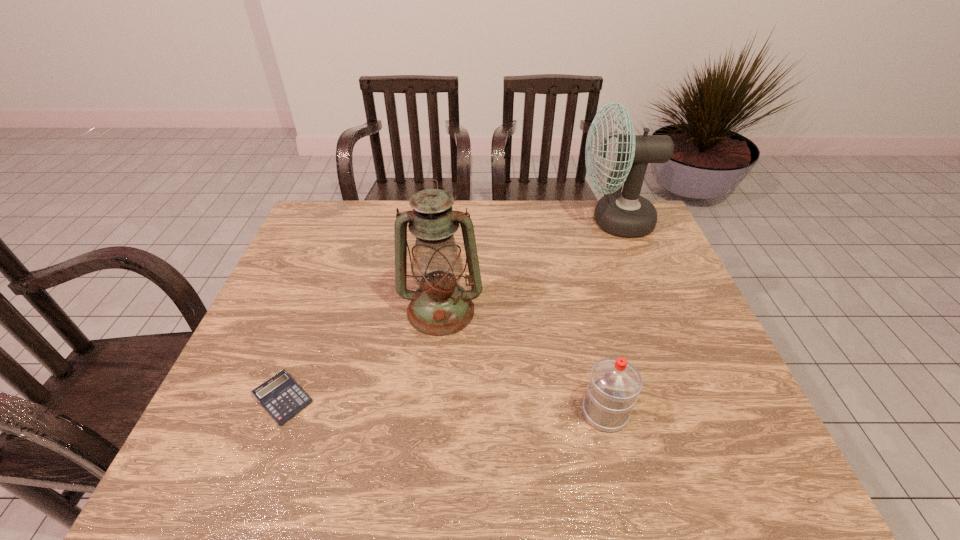
In order to click on fan in this screenshot , I will do `click(627, 214)`.

Where is `the farthest object`? the farthest object is located at coordinates (627, 214).

Find the location of a particular element. The image size is (960, 540). the second farthest object is located at coordinates [440, 306].

Identify the location of the second object from left to right. The height and width of the screenshot is (540, 960). (440, 306).

This screenshot has width=960, height=540. I want to click on the third tallest object, so click(x=614, y=385).

You are a GUI agent. You are given a task and a screenshot of the screen. Output one action in this format:
    pyautogui.click(x=<x>, y=<y>)
    Task: Click on the water bottle
    Image resolution: width=960 pixels, height=540 pixels.
    Given the screenshot: What is the action you would take?
    pyautogui.click(x=614, y=385)

Locate an element on the screen. The height and width of the screenshot is (540, 960). the leftmost object is located at coordinates (281, 396).

You are a GUI agent. You are given a task and a screenshot of the screen. Output one action in this format:
    pyautogui.click(x=<x>, y=<y>)
    Task: Click on the shortest object
    
    Given the screenshot: What is the action you would take?
    pyautogui.click(x=281, y=396)

Find the location of a particular element. Image resolution: width=960 pixels, height=540 pixels. free space located in front of the fan where the airflow is directed is located at coordinates (535, 221).

At what (x,y) coordinates should I click in order to perform the action: click on free spot located 0.150m in front of the fan where the airflow is directed. Please return your answer as a coordinate pair (x, y). This screenshot has height=540, width=960. Looking at the image, I should click on (532, 221).